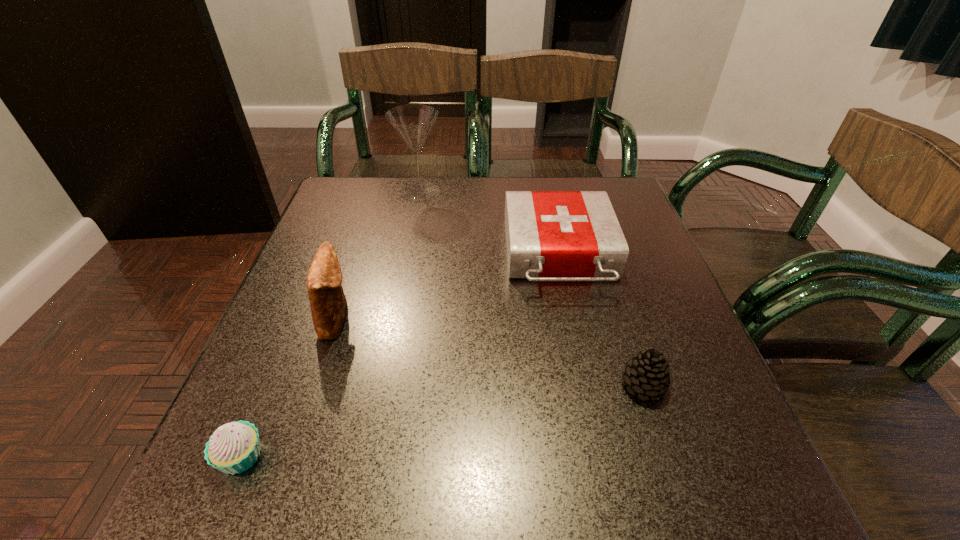
In order to click on free spot between the second nearest object and the first-aid kit in this screenshot , I will do `click(601, 319)`.

Identify the location of vacant point located between the second object from left to right and the nearest object. (289, 387).

Find the location of `vacant space in between the tallest object and the first-aid kit`. vacant space in between the tallest object and the first-aid kit is located at coordinates (490, 223).

You are a GUI agent. You are given a task and a screenshot of the screen. Output one action in this format:
    pyautogui.click(x=<x>, y=<y>)
    Task: Click on the free space between the leftmost object and the first-aid kit
    
    Given the screenshot: What is the action you would take?
    pyautogui.click(x=400, y=355)

What are the coordinates of `free spot between the fourth object from right to left and the flute glass` in the screenshot? It's located at (378, 255).

This screenshot has width=960, height=540. I want to click on vacant space that's between the first-aid kit and the leftmost object, so click(400, 355).

This screenshot has height=540, width=960. Identify the location of free point between the leftmost object and the second tallest object. (289, 387).

Locate an element on the screen. This screenshot has height=540, width=960. vacant area between the cupcake and the clutch bag is located at coordinates (289, 387).

Identify which object is located as the second nearest to the nearest object. Please provide its 2D coordinates. Your answer should be formatted as a tuple, i.e. [(x, y)], where the tuple contains the x and y coordinates of a point satisfying the conditions above.

[(550, 235)]

I want to click on object that stands as the closest to the clutch bag, so click(x=234, y=447).